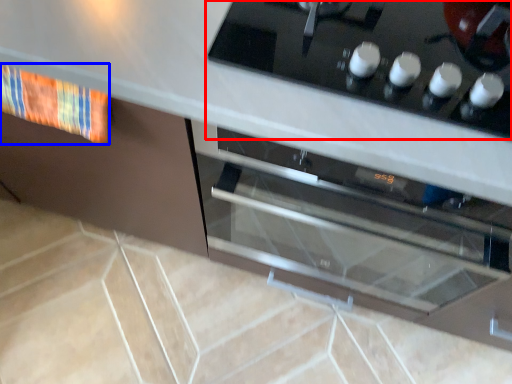
Question: Among these objects, which one is farthest to the camera, home appliance (highlighted by a red box) or material (highlighted by a blue box)?

Choices:
 (A) home appliance
 (B) material

Answer: (B)